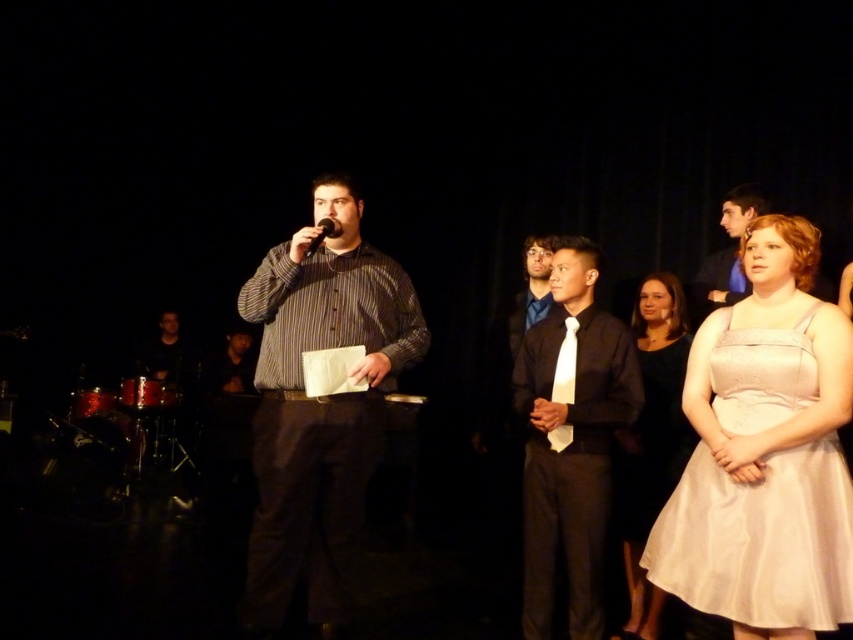
You are sitting in the audience and want to see both the point at [283,592] and the point at [577,288] clearly. Which point will appear closer to you?

The point at [283,592] will appear closer to you because it is closer to the viewer than the point at [577,288].

You are sitting in the audience and notice two performers on stage. One is wearing a black satin shirt at center and the other a matte blue shirt at center. Which performer is standing closer to the front of the stage?

The black satin shirt at center is closer to the viewer than the matte blue shirt at center, so the performer in the black satin shirt at center is standing closer to the front of the stage.